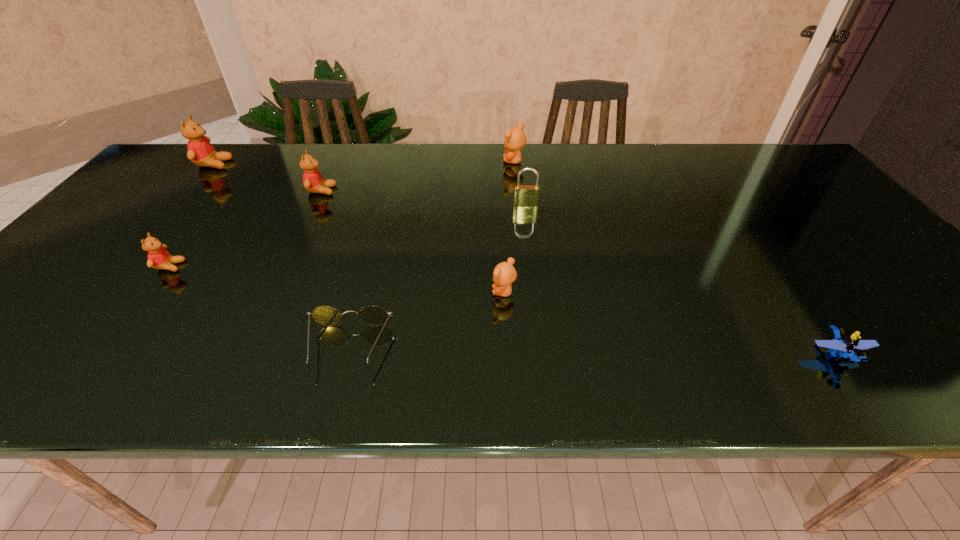
Find the location of a particular element. The height and width of the screenshot is (540, 960). the farthest red teddy bear is located at coordinates (200, 151).

Where is `the leftmost object`? This screenshot has height=540, width=960. the leftmost object is located at coordinates pos(200,151).

Find the location of a particular element. The height and width of the screenshot is (540, 960). the third farthest teddy bear is located at coordinates (313, 182).

The width and height of the screenshot is (960, 540). I want to click on the second farthest red teddy bear, so click(313, 182).

Identify the location of the bigger brown teddy bear. (515, 138).

Image resolution: width=960 pixels, height=540 pixels. I want to click on brass padlock, so click(524, 195).

Find the location of `the fourth farthest object`. the fourth farthest object is located at coordinates (524, 195).

At what (x,y) coordinates should I click in order to perform the action: click on the sixth farthest object. Please return your answer as a coordinate pair (x, y). The height and width of the screenshot is (540, 960). Looking at the image, I should click on (504, 274).

Image resolution: width=960 pixels, height=540 pixels. Identify the location of the smaller brown teddy bear. (504, 274).

This screenshot has width=960, height=540. Identify the location of the fifth farthest object. (158, 257).